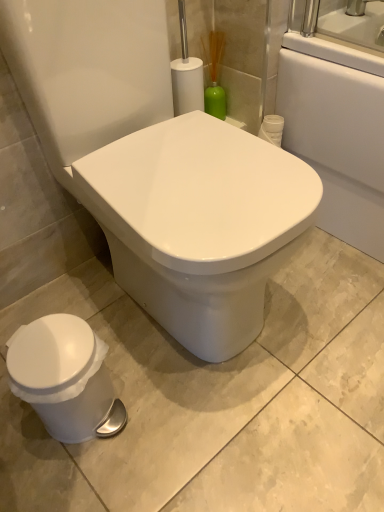
Locate an element on the screen. Image resolution: width=384 pixels, height=512 pixels. free space to the back side of white plastic trash can at lower left is located at coordinates (124, 335).